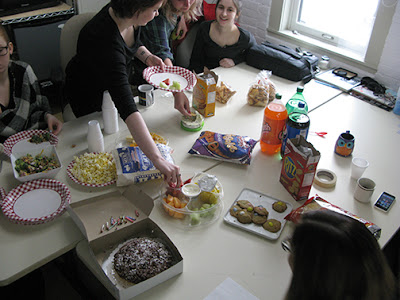
Locate an element on the screen. The image size is (400, 300). plate is located at coordinates (38, 209).